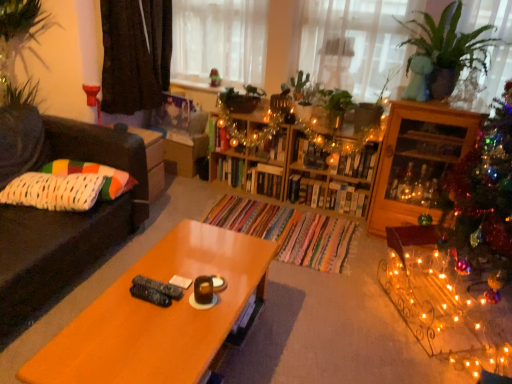
Where is `free area in between wooden cabinet at right and wooden bookshelf at center, positioned as the first shelf in right-to-left order`? free area in between wooden cabinet at right and wooden bookshelf at center, positioned as the first shelf in right-to-left order is located at coordinates (329, 216).